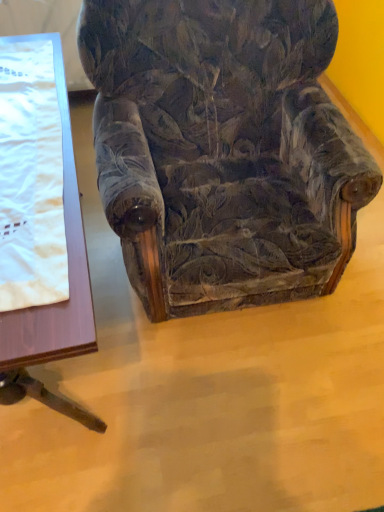
Question: From the image's perspective, is wooden table at left on white satin blanket at left?

Choices:
 (A) no
 (B) yes

Answer: (A)

Question: Is wooden table at left bigger than white satin blanket at left?

Choices:
 (A) no
 (B) yes

Answer: (B)

Question: Considering the relative positions of wooden table at left and white satin blanket at left in the image provided, is wooden table at left in front of white satin blanket at left?

Choices:
 (A) no
 (B) yes

Answer: (B)

Question: Considering the relative sizes of wooden table at left and white satin blanket at left in the image provided, is wooden table at left taller than white satin blanket at left?

Choices:
 (A) no
 (B) yes

Answer: (B)

Question: From the image's perspective, is wooden table at left beneath white satin blanket at left?

Choices:
 (A) no
 (B) yes

Answer: (B)

Question: From a real-world perspective, is velvet floral-patterned armchair at center physically located above or below white satin blanket at left?

Choices:
 (A) below
 (B) above

Answer: (A)

Question: Based on their sizes in the image, would you say velvet floral-patterned armchair at center is bigger or smaller than white satin blanket at left?

Choices:
 (A) small
 (B) big

Answer: (B)

Question: Relative to white satin blanket at left, is velvet floral-patterned armchair at center in front or behind?

Choices:
 (A) front
 (B) behind

Answer: (A)

Question: From the image's perspective, is velvet floral-patterned armchair at center above or below white satin blanket at left?

Choices:
 (A) below
 (B) above

Answer: (B)

Question: Relative to velvet floral-patterned armchair at center, is wooden table at left in front or behind?

Choices:
 (A) front
 (B) behind

Answer: (B)

Question: In terms of height, does wooden table at left look taller or shorter compared to velvet floral-patterned armchair at center?

Choices:
 (A) tall
 (B) short

Answer: (B)

Question: Considering the positions of point (0, 310) and point (312, 81), is point (0, 310) closer or farther from the camera than point (312, 81)?

Choices:
 (A) closer
 (B) farther

Answer: (A)

Question: Would you say wooden table at left is to the left or to the right of velvet floral-patterned armchair at center in the picture?

Choices:
 (A) left
 (B) right

Answer: (A)

Question: Considering the positions of wooden table at left and white satin blanket at left in the image, is wooden table at left bigger or smaller than white satin blanket at left?

Choices:
 (A) big
 (B) small

Answer: (A)

Question: From a real-world perspective, relative to white satin blanket at left, is wooden table at left vertically above or below?

Choices:
 (A) above
 (B) below

Answer: (B)